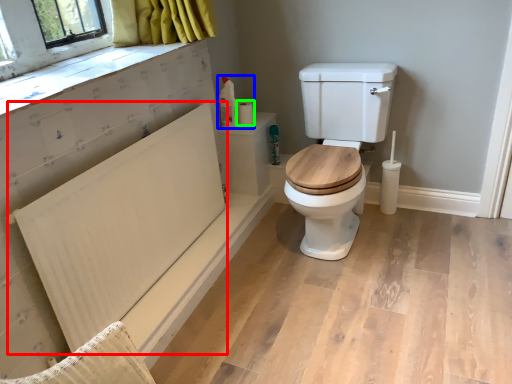
Question: Which object is positioned farthest from radiator (highlighted by a red box)? Select from toilet paper (highlighted by a blue box) and toilet paper (highlighted by a green box).

Choices:
 (A) toilet paper
 (B) toilet paper

Answer: (B)